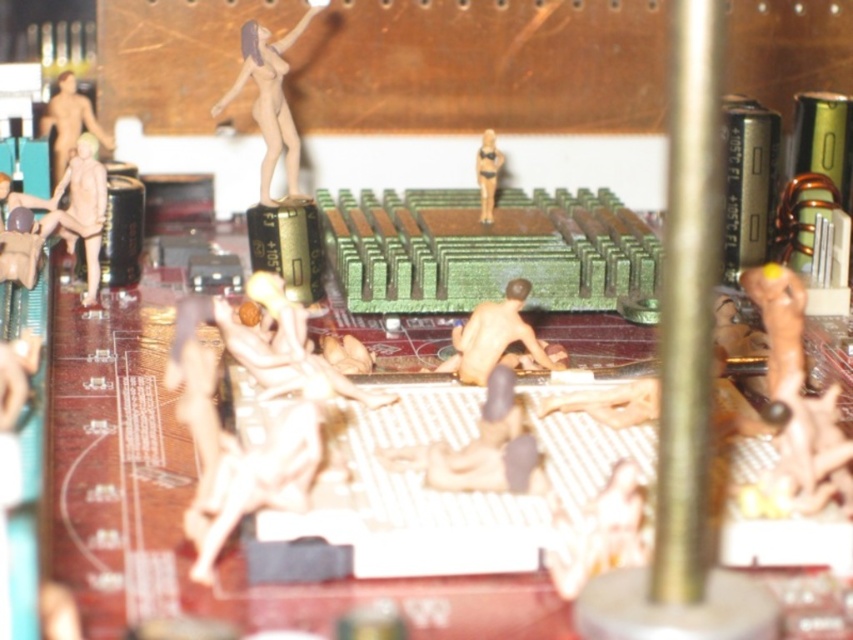
Question: Estimate the real-world distances between objects in this image. Which object is farther from the matte plastic nude figure at upper center?

Choices:
 (A) nude figure at center
 (B) matte beige figure at left
 (C) matte yellow bikini at center

Answer: (A)

Question: Considering the real-world distances, which object is farthest from the matte yellow bikini at center?

Choices:
 (A) matte beige figure at left
 (B) nude figure at center
 (C) matte plastic person at upper left
 (D) matte plastic nude figure at upper center

Answer: (C)

Question: Is nude figure at center wider than matte beige figure at left?

Choices:
 (A) no
 (B) yes

Answer: (B)

Question: Is matte beige figure at left thinner than matte yellow bikini at center?

Choices:
 (A) no
 (B) yes

Answer: (A)

Question: Which object is positioned closest to the matte beige figure at left?

Choices:
 (A) matte plastic nude figure at upper center
 (B) matte yellow bikini at center
 (C) matte plastic person at upper left
 (D) nude figure at center

Answer: (C)

Question: From the image, what is the correct spatial relationship of matte plastic nude figure at upper center in relation to matte yellow bikini at center?

Choices:
 (A) right
 (B) left

Answer: (B)